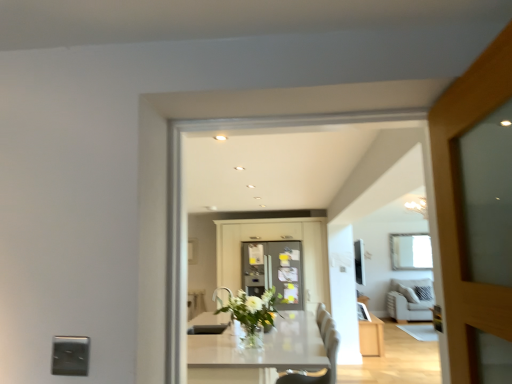
Question: Is satin silver outlet at lower left at the left side of white glossy table at center?

Choices:
 (A) no
 (B) yes

Answer: (B)

Question: From a real-world perspective, is satin silver outlet at lower left on top of white glossy table at center?

Choices:
 (A) no
 (B) yes

Answer: (B)

Question: Can you confirm if satin silver outlet at lower left is shorter than white glossy table at center?

Choices:
 (A) no
 (B) yes

Answer: (B)

Question: Is satin silver outlet at lower left to the right of white glossy table at center from the viewer's perspective?

Choices:
 (A) no
 (B) yes

Answer: (A)

Question: Would you say satin silver outlet at lower left is outside white glossy table at center?

Choices:
 (A) no
 (B) yes

Answer: (B)

Question: In terms of size, does satin silver outlet at lower left appear bigger or smaller than white glass vase at center?

Choices:
 (A) small
 (B) big

Answer: (A)

Question: From a real-world perspective, relative to white glass vase at center, is satin silver outlet at lower left vertically above or below?

Choices:
 (A) above
 (B) below

Answer: (A)

Question: Is point (80, 359) closer or farther from the camera than point (276, 299)?

Choices:
 (A) farther
 (B) closer

Answer: (B)

Question: From the image's perspective, is satin silver outlet at lower left positioned above or below white glass vase at center?

Choices:
 (A) below
 (B) above

Answer: (B)

Question: Relative to white fabric couch at right, is white glossy table at center in front or behind?

Choices:
 (A) front
 (B) behind

Answer: (A)

Question: Is white glossy table at center spatially inside white fabric couch at right, or outside of it?

Choices:
 (A) outside
 (B) inside

Answer: (A)

Question: From a real-world perspective, relative to white fabric couch at right, is white glossy table at center vertically above or below?

Choices:
 (A) below
 (B) above

Answer: (A)

Question: Looking at the image, does white glossy table at center seem bigger or smaller compared to white fabric couch at right?

Choices:
 (A) small
 (B) big

Answer: (B)

Question: Is white fabric couch at right spatially inside white glass vase at center, or outside of it?

Choices:
 (A) inside
 (B) outside

Answer: (B)

Question: From a real-world perspective, is white fabric couch at right positioned above or below white glass vase at center?

Choices:
 (A) above
 (B) below

Answer: (B)